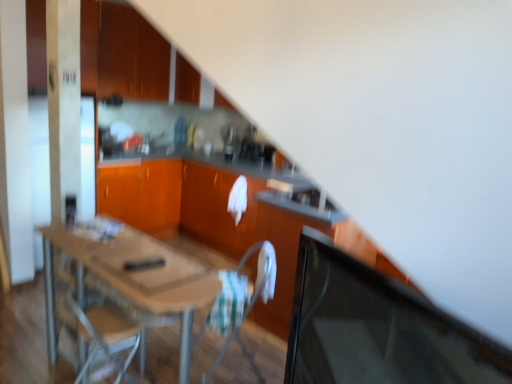
Locate an element on the screen. free space above wooden table at center (from a real-world perspective) is located at coordinates (112, 252).